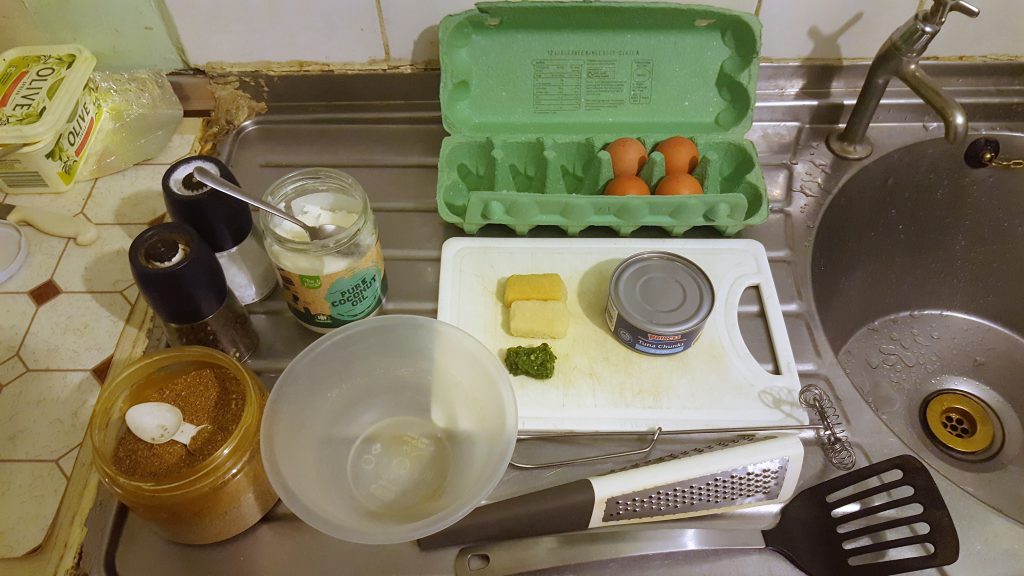
Where is `manual whisk`? The height and width of the screenshot is (576, 1024). manual whisk is located at coordinates (830, 428).